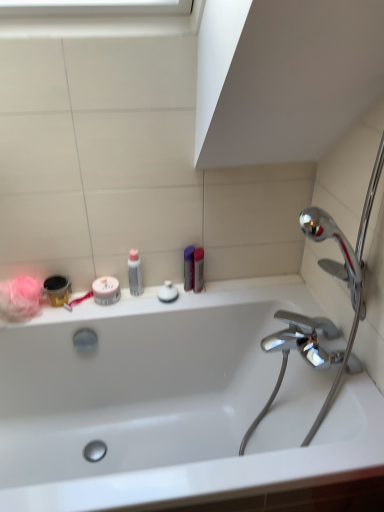
At what (x,y) coordinates should I click in order to perform the action: click on space that is in front of white matte jar at center, which ranks as the 2th mouthwash in right-to-left order. Please return your answer as a coordinate pair (x, y). The width and height of the screenshot is (384, 512). Looking at the image, I should click on (100, 314).